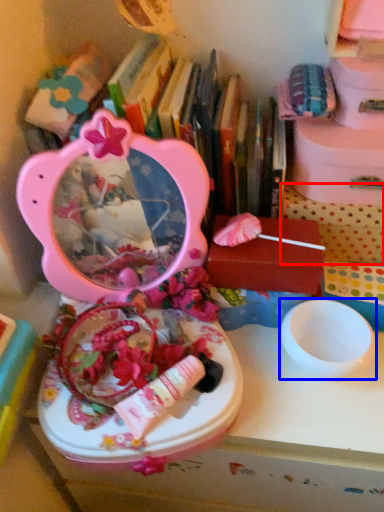
Question: Among these objects, which one is nearest to the camera, storage box (highlighted by a red box) or bowl (highlighted by a blue box)?

Choices:
 (A) storage box
 (B) bowl

Answer: (B)